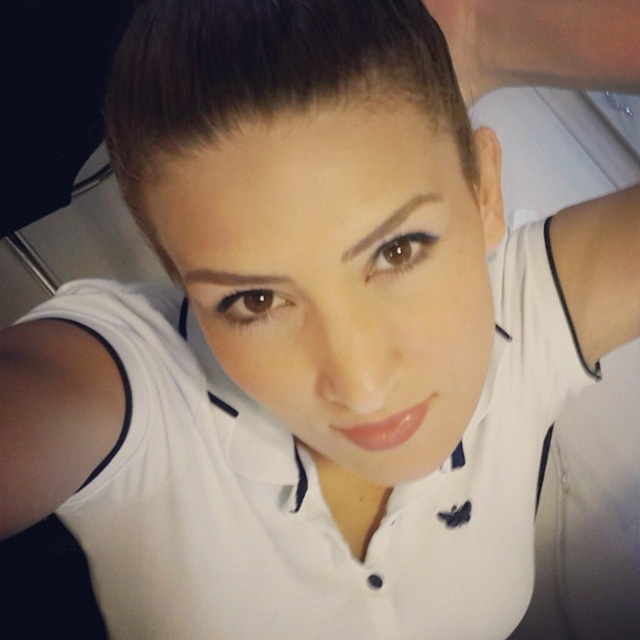
Is dark brown shiny hair at upper center bigger than brownhaireyebrow at center?

Correct, dark brown shiny hair at upper center is larger in size than brownhaireyebrow at center.

Between point (193, 141) and point (387, 228), which one is positioned behind?

Positioned behind is point (387, 228).

The image size is (640, 640). Find the location of `dark brown shiny hair at upper center`. dark brown shiny hair at upper center is located at coordinates (262, 76).

Between white cotton polo shirt at center and brownhaireyebrow at center, which one is positioned higher?

brownhaireyebrow at center is higher up.

Is white cotton polo shirt at center shorter than brownhaireyebrow at center?

No.

Who is more forward, (349,632) or (420,202)?

Point (420,202) is in front.

Image resolution: width=640 pixels, height=640 pixels. What are the coordinates of `white cotton polo shirt at center` in the screenshot? It's located at (310, 484).

Is white cotton polo shirt at center above dark brown shiny hair at upper center?

No.

Who is lower down, white cotton polo shirt at center or dark brown shiny hair at upper center?

Positioned lower is white cotton polo shirt at center.

Is point (500, 436) farther from viewer compared to point (157, 112)?

Yes.

This screenshot has height=640, width=640. In order to click on white cotton polo shirt at center in this screenshot , I will do `click(310, 484)`.